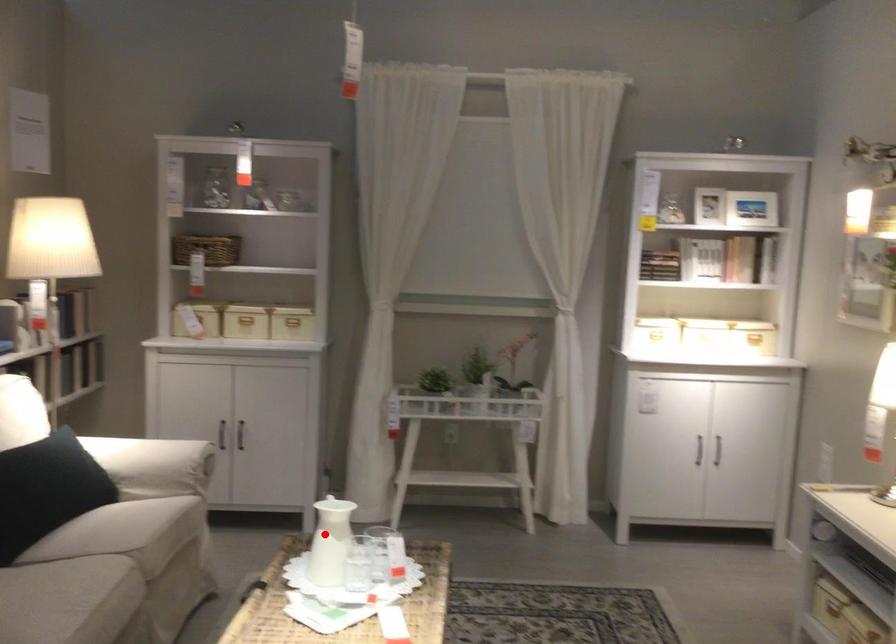
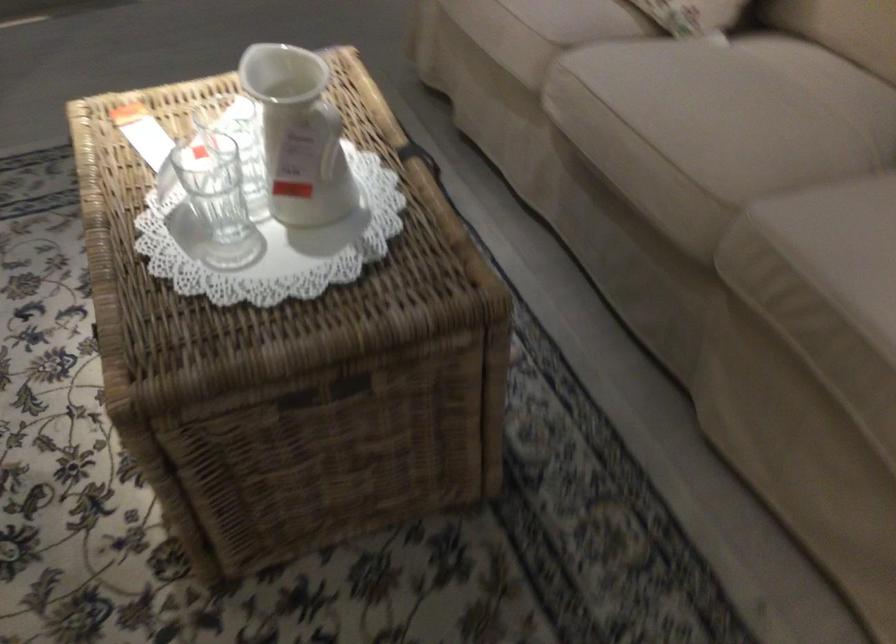
Find the pixel in the second image that matches the highlighted location in the first image.

(328, 137)